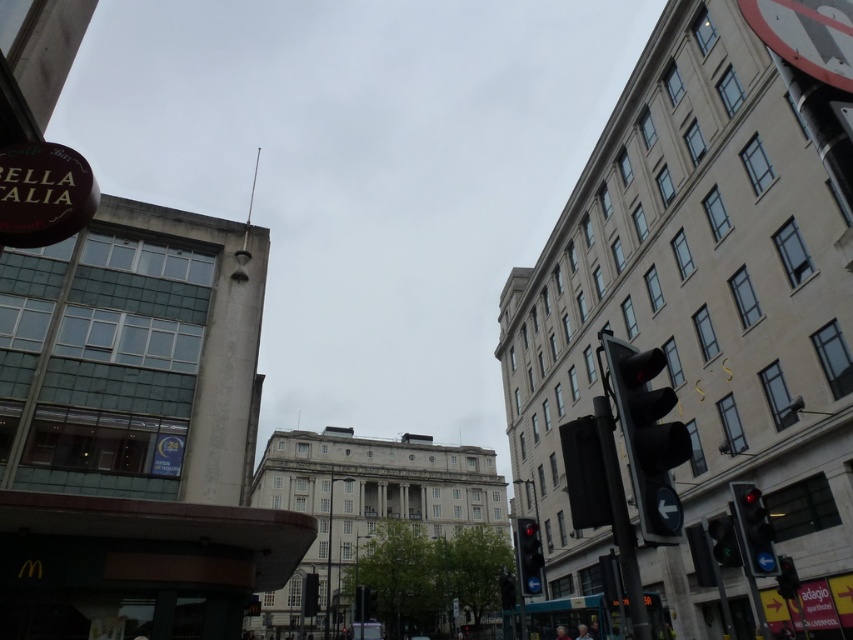
You are a delivery person standing at the camera position. You need to place a package on the ground near the metallic pole at right. Can you reach the pole without moving more than 3 meters from your current position?

The metallic pole at right is 3.02 meters away from the camera. Since the delivery person needs to move less than 3 meters, they cannot reach the pole without exceeding the distance limit.